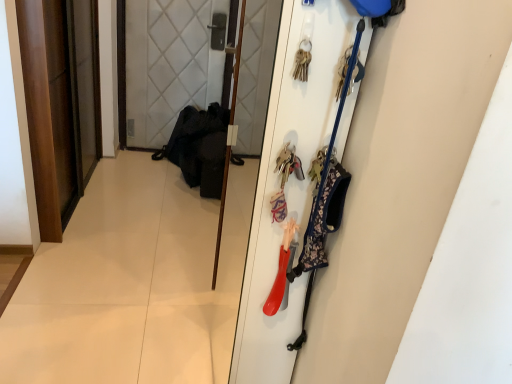
Find the location of a particular element. Image resolution: width=512 pixels, height=384 pixels. vacant area in front of wooden screen door at center is located at coordinates (180, 283).